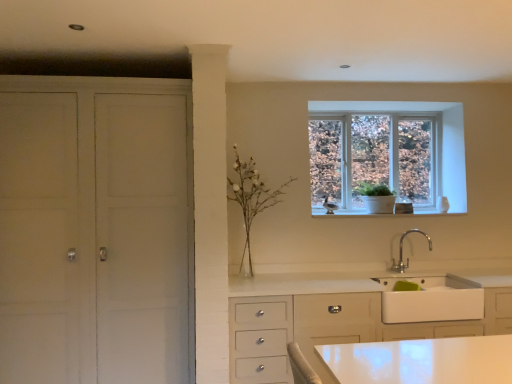
Question: Is clear glass window at upper center thinner than white matte cabinet at left?

Choices:
 (A) yes
 (B) no

Answer: (A)

Question: Is clear glass window at upper center positioned before white matte cabinet at left?

Choices:
 (A) no
 (B) yes

Answer: (A)

Question: Is clear glass window at upper center surrounding white matte cabinet at left?

Choices:
 (A) no
 (B) yes

Answer: (A)

Question: Is clear glass window at upper center facing towards white matte cabinet at left?

Choices:
 (A) no
 (B) yes

Answer: (A)

Question: Is clear glass window at upper center positioned with its back to white matte cabinet at left?

Choices:
 (A) no
 (B) yes

Answer: (A)

Question: Which is correct: chrome metallic faucet at lower right is inside white glass vase at center, or outside of it?

Choices:
 (A) outside
 (B) inside

Answer: (A)

Question: From their relative heights in the image, would you say chrome metallic faucet at lower right is taller or shorter than white glass vase at center?

Choices:
 (A) short
 (B) tall

Answer: (A)

Question: From the image's perspective, is chrome metallic faucet at lower right above or below white glass vase at center?

Choices:
 (A) below
 (B) above

Answer: (A)

Question: Considering the positions of point [401, 235] and point [245, 196], is point [401, 235] closer or farther from the camera than point [245, 196]?

Choices:
 (A) closer
 (B) farther

Answer: (B)

Question: In the image, is white matte sink at lower right positioned in front of or behind white matte cabinet at left?

Choices:
 (A) behind
 (B) front

Answer: (A)

Question: From a real-world perspective, is white matte sink at lower right positioned above or below white matte cabinet at left?

Choices:
 (A) above
 (B) below

Answer: (B)

Question: Choose the correct answer: Is white matte sink at lower right inside white matte cabinet at left or outside it?

Choices:
 (A) inside
 (B) outside

Answer: (B)

Question: From their relative heights in the image, would you say white matte sink at lower right is taller or shorter than white matte cabinet at left?

Choices:
 (A) short
 (B) tall

Answer: (A)

Question: In terms of size, does chrome metallic faucet at lower right appear bigger or smaller than white matte sink at lower right?

Choices:
 (A) big
 (B) small

Answer: (B)

Question: From the image's perspective, is chrome metallic faucet at lower right positioned above or below white matte sink at lower right?

Choices:
 (A) below
 (B) above

Answer: (B)